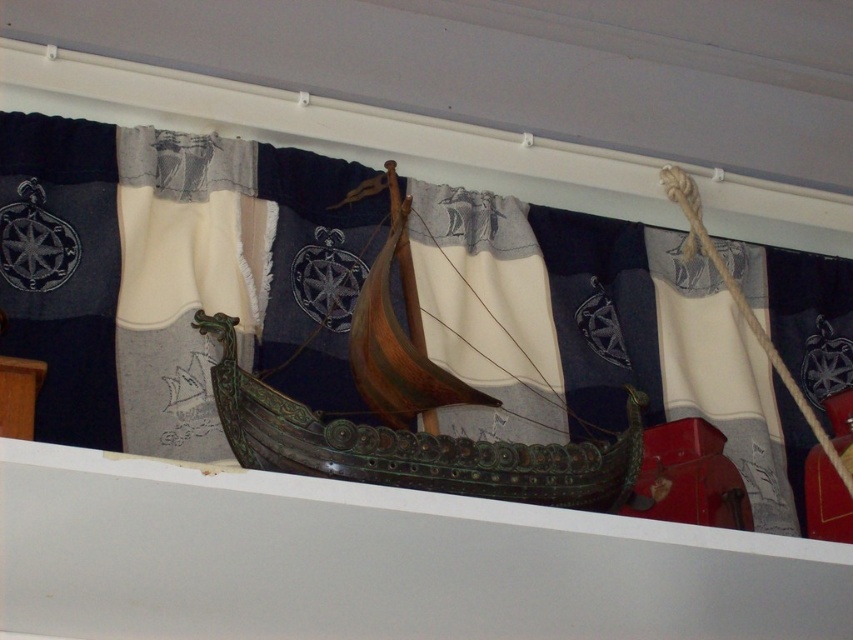
You are an interior designer arranging a nautical themed display. You have a wooden ship at center and a white textured fabric at left. Which object is wider?

The wooden ship at center is wider than the white textured fabric at left.

You are a museum curator planning to move the wooden ship at center closer to the dark blue fabric with nautical symbols at center. If the minimum safe distance required between them for preservation purposes is 3 meters, can you move the ship to within that distance?

The current distance between the dark blue fabric with nautical symbols at center and the wooden ship at center is 4.38 meters. Since the minimum safe distance required is 3 meters, moving the ship closer to within 3 meters would violate the preservation guidelines. Therefore, you cannot move the ship to within the 3 meter distance without compromising safety standards.

You are an interior designer arranging a nautical themed display. You have a dark blue fabric with nautical symbols at center and a white textured fabric at left. Which fabric is covering the other one?

The dark blue fabric with nautical symbols at center is positioned under the white textured fabric at left, so the white textured fabric at left is covering the dark blue fabric with nautical symbols at center.